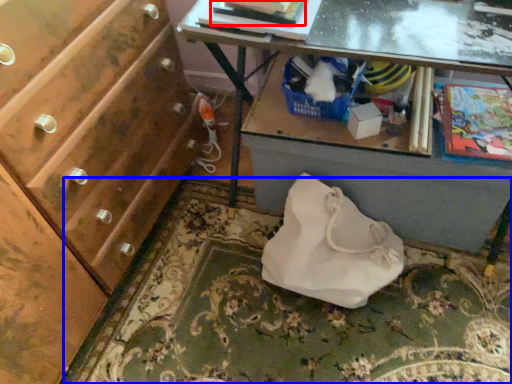
Question: Which of the following is the closest to the observer, magazine (highlighted by a red box) or mat (highlighted by a blue box)?

Choices:
 (A) magazine
 (B) mat

Answer: (A)